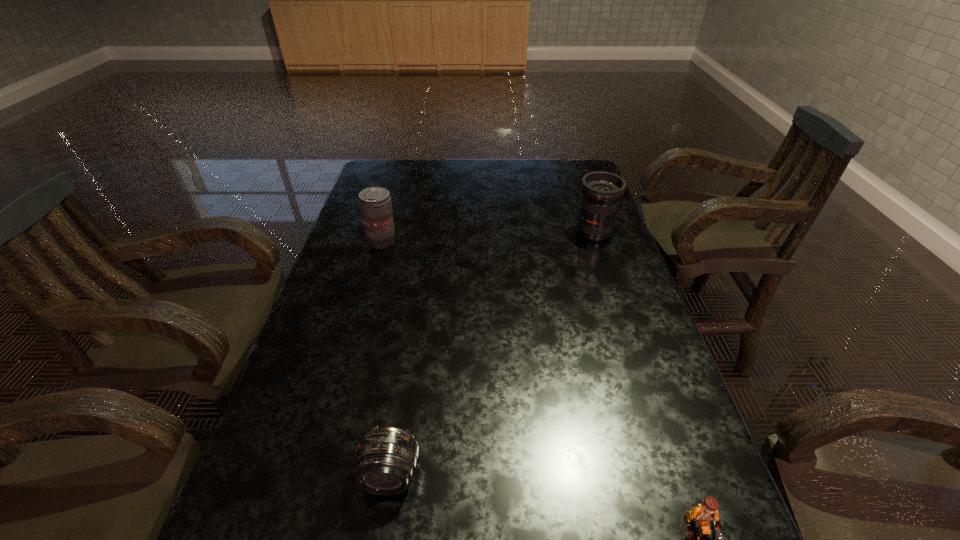
You are a GUI agent. You are given a task and a screenshot of the screen. Output one action in this format:
    pyautogui.click(x=<x>, y=<y>)
    Task: Click on the rightmost telephoto lens
    
    Given the screenshot: What is the action you would take?
    pyautogui.click(x=601, y=190)

Image resolution: width=960 pixels, height=540 pixels. Find the location of `the leftmost object`. the leftmost object is located at coordinates (375, 203).

Identify the location of the third tallest object. This screenshot has width=960, height=540. (385, 459).

Where is `the second telephoto lens from right to left`? the second telephoto lens from right to left is located at coordinates (385, 459).

Locate an element on the screen. vacant space located on the left of the rightmost telephoto lens is located at coordinates (514, 232).

At what (x,y) coordinates should I click in order to perform the action: click on vacant space located on the side of the leftmost object where the control switches are located. Please return your answer as a coordinate pair (x, y). Looking at the image, I should click on tap(508, 242).

At what (x,y) coordinates should I click in order to perform the action: click on free space located 0.050m at the front element of the shortest telephoto lens. Please return your answer as a coordinate pair (x, y). Looking at the image, I should click on (382, 529).

Identify the location of object present at the left edge. The height and width of the screenshot is (540, 960). (375, 203).

The width and height of the screenshot is (960, 540). I want to click on object positioned at the right edge, so click(x=601, y=190).

Find the location of a particular element. vacant space at the far edge of the desktop is located at coordinates (428, 166).